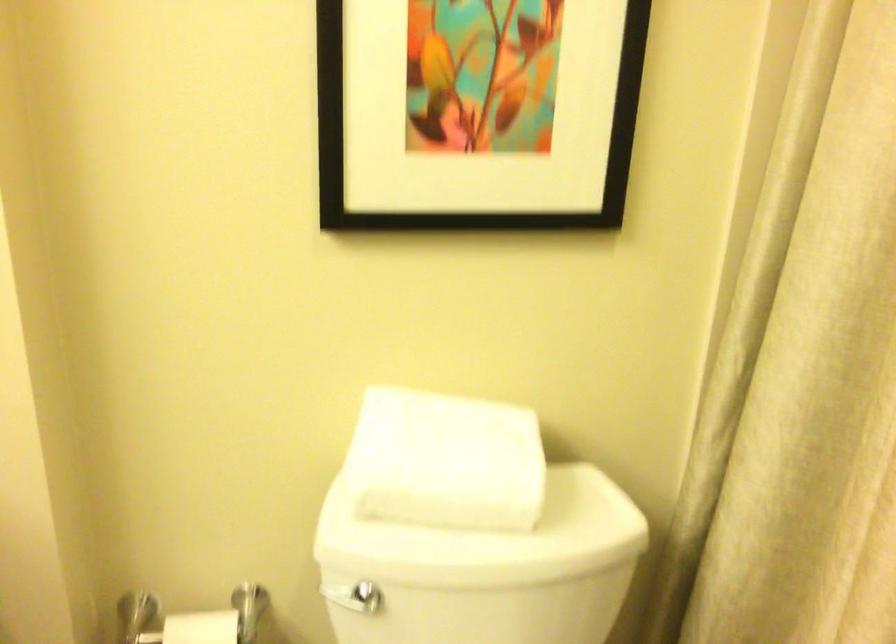
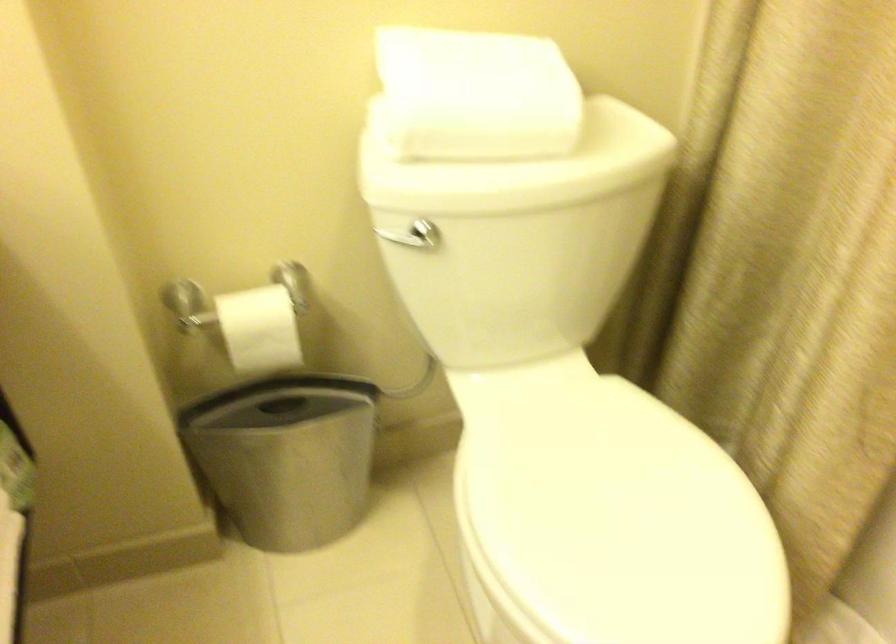
Question: Which direction would the cameraman need to move to produce the second image? Reply with the corresponding letter.

Choices:
 (A) Left
 (B) Right
 (C) Forward
 (D) Backward

Answer: (A)